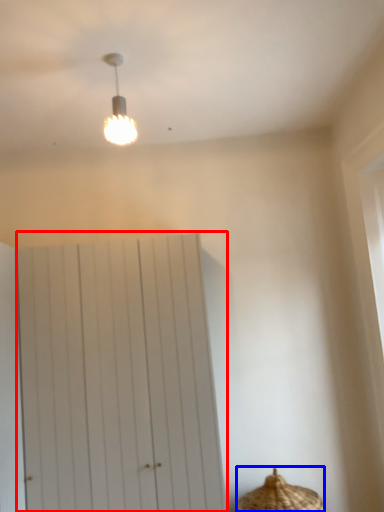
Question: Which object is further to the camera taking this photo, barn door (highlighted by a red box) or basket (highlighted by a blue box)?

Choices:
 (A) barn door
 (B) basket

Answer: (A)